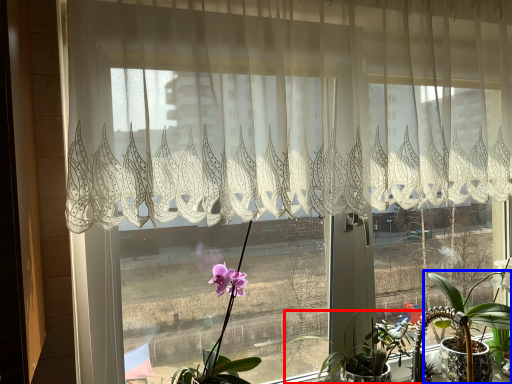
Question: Which object is closer to the camera taking this photo, houseplant (highlighted by a red box) or houseplant (highlighted by a blue box)?

Choices:
 (A) houseplant
 (B) houseplant

Answer: (A)